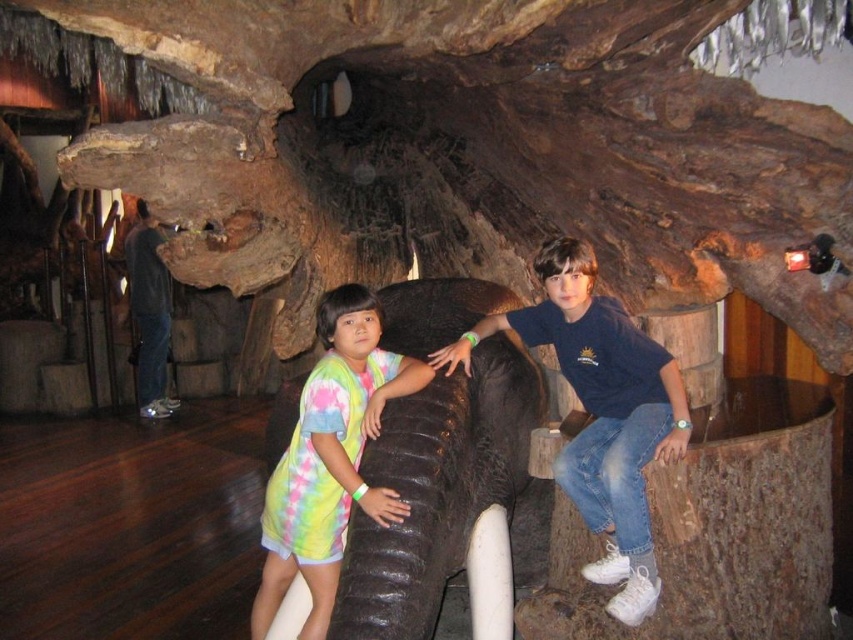
Question: Is blue cotton shirt at center thinner than tie-dye fabric shirt at center?

Choices:
 (A) no
 (B) yes

Answer: (A)

Question: Which object is farther from the camera taking this photo?

Choices:
 (A) blue cotton shirt at center
 (B) tie-dye fabric shirt at center

Answer: (A)

Question: Can you confirm if blue cotton shirt at center is positioned to the left of tie-dye fabric shirt at center?

Choices:
 (A) no
 (B) yes

Answer: (A)

Question: Where is blue cotton shirt at center located in relation to tie-dye fabric shirt at center in the image?

Choices:
 (A) right
 (B) left

Answer: (A)